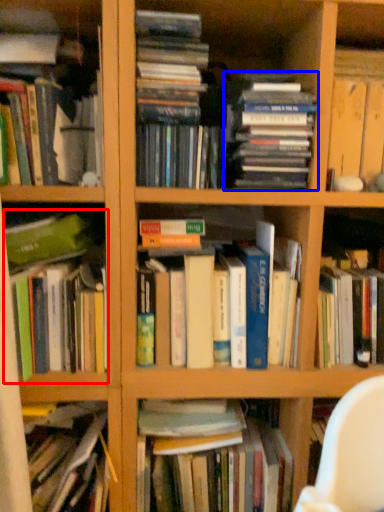
Question: Which of the following is the farthest to the observer, book (highlighted by a red box) or book (highlighted by a blue box)?

Choices:
 (A) book
 (B) book

Answer: (A)